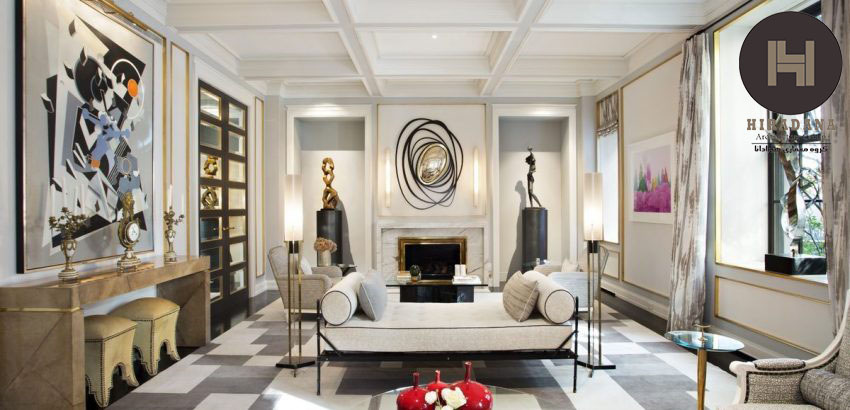
Locate an element on the screen. The width and height of the screenshot is (850, 410). glass tabletop is located at coordinates (687, 338).